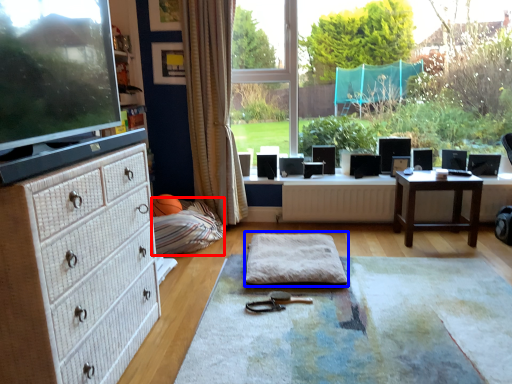
Question: Which object is further to the camera taking this photo, bean bag chair (highlighted by a red box) or yoga mat (highlighted by a blue box)?

Choices:
 (A) bean bag chair
 (B) yoga mat

Answer: (A)